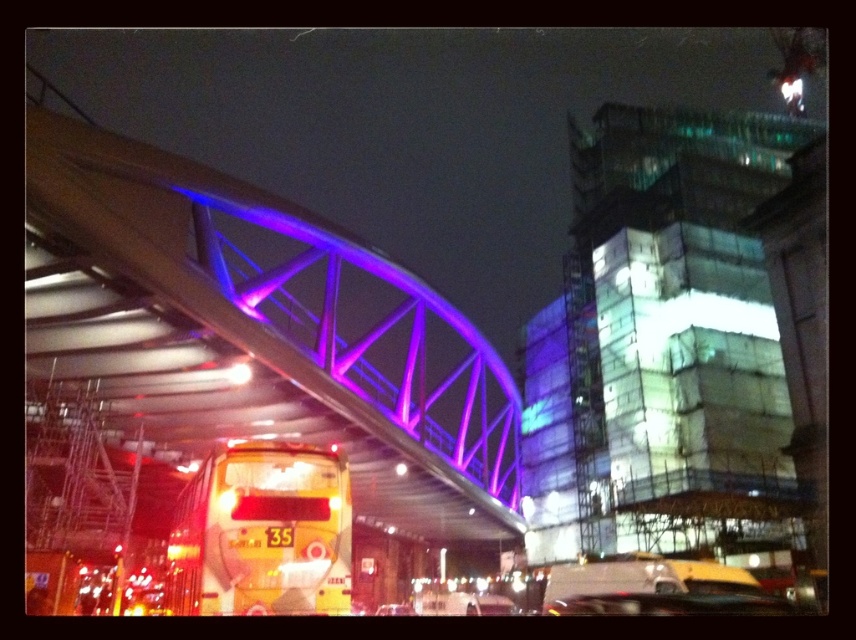
Question: Does metallic purple bridge at upper center appear over yellow matte/decorative bus at lower left?

Choices:
 (A) yes
 (B) no

Answer: (A)

Question: Among these points, which one is nearest to the camera?

Choices:
 (A) (275, 308)
 (B) (324, 499)

Answer: (B)

Question: Which object is farther from the camera taking this photo?

Choices:
 (A) metallic purple bridge at upper center
 (B) yellow matte/decorative bus at lower left

Answer: (B)

Question: Where is metallic purple bridge at upper center located in relation to yellow matte/decorative bus at lower left in the image?

Choices:
 (A) above
 (B) below

Answer: (A)

Question: Can you confirm if metallic purple bridge at upper center is bigger than yellow matte/decorative bus at lower left?

Choices:
 (A) no
 (B) yes

Answer: (B)